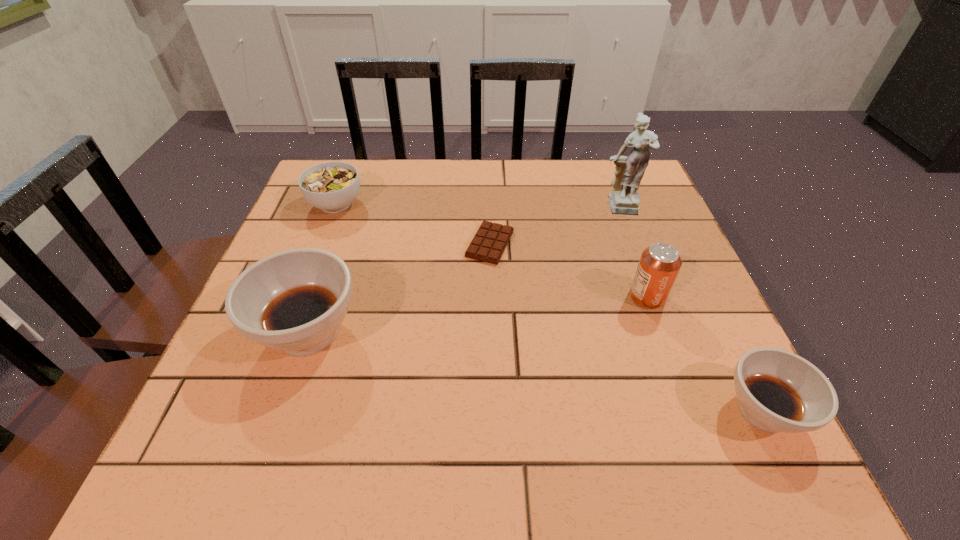
Where is `soup bowl that stands as the second closest to the rightmost soup bowl`? soup bowl that stands as the second closest to the rightmost soup bowl is located at coordinates (331, 186).

Locate which soup bowl is the second closest to the farthest soup bowl. Please provide its 2D coordinates. Your answer should be formatted as a tuple, i.e. [(x, y)], where the tuple contains the x and y coordinates of a point satisfying the conditions above.

[(778, 391)]

Locate an element on the screen. This screenshot has height=540, width=960. free space in the image that satisfies the following two spatial constraints: 1. on the front side of the tallest soup bowl; 2. on the left side of the farthest soup bowl is located at coordinates (286, 332).